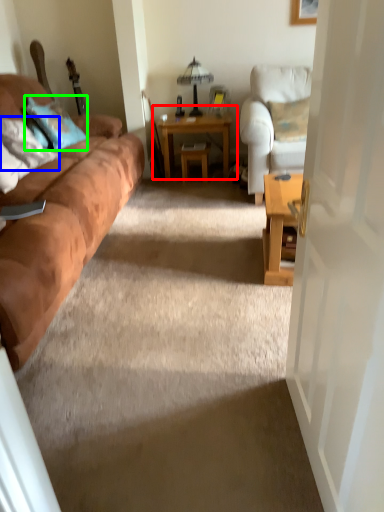
Question: Which object is positioned farthest from table (highlighted by a red box)? Select from pillow (highlighted by a blue box) and pillow (highlighted by a green box).

Choices:
 (A) pillow
 (B) pillow

Answer: (A)